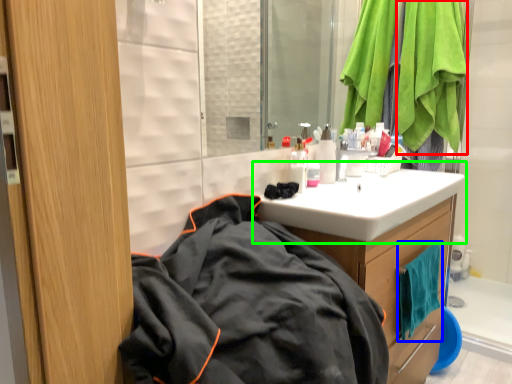
Question: Estimate the real-world distances between objects in this image. Which object is farther from blanket (highlighted by a red box), beach towel (highlighted by a blue box) or sink (highlighted by a green box)?

Choices:
 (A) beach towel
 (B) sink

Answer: (A)